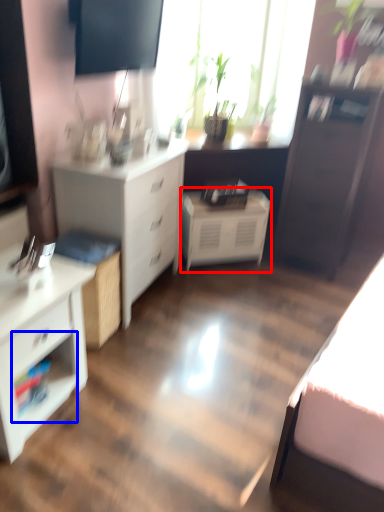
Question: Which point is closer to the camera, nightstand (highlighted by a red box) or shelf (highlighted by a blue box)?

Choices:
 (A) nightstand
 (B) shelf

Answer: (B)